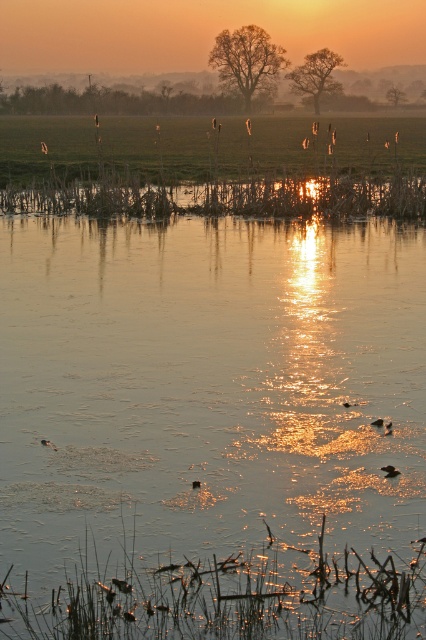
Which is in front, point (14, 458) or point (152, 212)?

Positioned in front is point (14, 458).

Between translucent water at center and translucent reed at center, which one has less height?

With less height is translucent reed at center.

Is point (344, 371) in front of point (259, 212)?

Yes, point (344, 371) is closer to viewer.

At what (x,y) coordinates should I click in order to perform the action: click on translucent water at center. Please return your answer as a coordinate pair (x, y). Looking at the image, I should click on (213, 412).